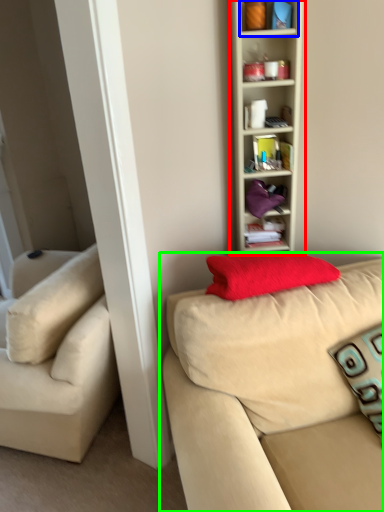
Question: Estimate the real-world distances between objects in this image. Which object is closer to shelf (highlighted by a red box), cabinet (highlighted by a blue box) or studio couch (highlighted by a green box)?

Choices:
 (A) cabinet
 (B) studio couch

Answer: (A)